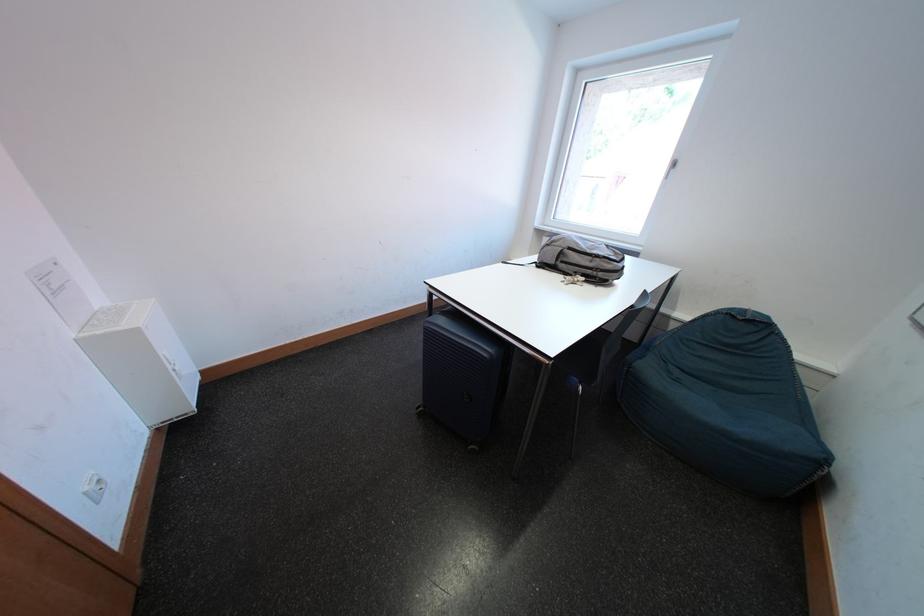
At what (x,y) coordinates should I click in order to perform the action: click on backpack handle. Please return your answer as a coordinate pair (x, y). The image size is (924, 616). Looking at the image, I should click on (606, 265).